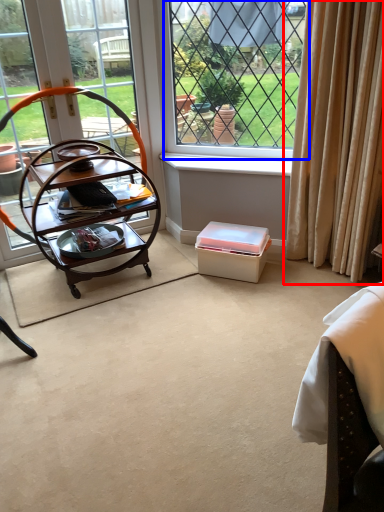
Question: Which object is further to the camera taking this photo, curtain (highlighted by a red box) or window (highlighted by a blue box)?

Choices:
 (A) curtain
 (B) window

Answer: (B)